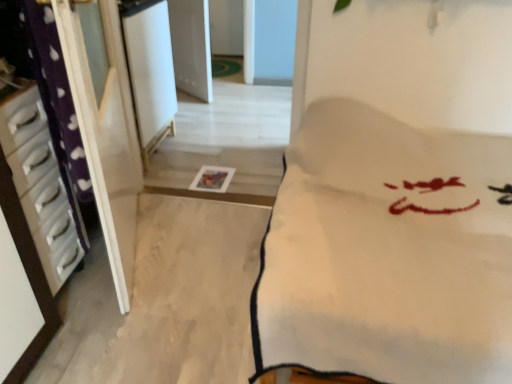
Question: Is white glossy drawer at left, which ranks as the 2th furniture in right-to-left order, oriented towards white glossy screen door at upper center?

Choices:
 (A) yes
 (B) no

Answer: (B)

Question: Is white glossy drawer at left, which ranks as the 2th furniture in right-to-left order, beside white glossy screen door at upper center?

Choices:
 (A) no
 (B) yes

Answer: (A)

Question: Is white glossy drawer at left, which ranks as the 2th furniture in right-to-left order, positioned in front of white glossy screen door at upper center?

Choices:
 (A) no
 (B) yes

Answer: (B)

Question: Considering the relative sizes of white glossy drawer at left, which ranks as the 2th furniture in right-to-left order, and white glossy screen door at upper center in the image provided, is white glossy drawer at left, which ranks as the 2th furniture in right-to-left order, wider than white glossy screen door at upper center?

Choices:
 (A) no
 (B) yes

Answer: (A)

Question: From the image's perspective, is white glossy drawer at left, which ranks as the 2th furniture in right-to-left order, over white glossy screen door at upper center?

Choices:
 (A) no
 (B) yes

Answer: (A)

Question: From a real-world perspective, is white glossy screen door at upper center above or below white soft blanket at center, which appears as the 2th furniture when viewed from the left?

Choices:
 (A) above
 (B) below

Answer: (A)

Question: Is point (144, 109) positioned closer to the camera than point (307, 294)?

Choices:
 (A) closer
 (B) farther

Answer: (B)

Question: From the image's perspective, is white glossy screen door at upper center positioned above or below white soft blanket at center, which is the first furniture in right-to-left order?

Choices:
 (A) below
 (B) above

Answer: (B)

Question: Is white glossy screen door at upper center situated inside white soft blanket at center, which appears as the 2th furniture when viewed from the left, or outside?

Choices:
 (A) inside
 (B) outside

Answer: (B)

Question: From a real-world perspective, relative to white soft blanket at center, which appears as the 2th furniture when viewed from the left, is white glossy drawer at left, which ranks as the 2th furniture in right-to-left order, vertically above or below?

Choices:
 (A) above
 (B) below

Answer: (B)

Question: Relative to white soft blanket at center, which appears as the 2th furniture when viewed from the left, is white glossy drawer at left, marked as the first furniture in a left-to-right arrangement, in front or behind?

Choices:
 (A) front
 (B) behind

Answer: (B)

Question: Is white glossy drawer at left, which ranks as the 2th furniture in right-to-left order, bigger or smaller than white soft blanket at center, which is the first furniture in right-to-left order?

Choices:
 (A) big
 (B) small

Answer: (B)

Question: Is white glossy drawer at left, which ranks as the 2th furniture in right-to-left order, situated inside white soft blanket at center, which appears as the 2th furniture when viewed from the left, or outside?

Choices:
 (A) outside
 (B) inside

Answer: (A)

Question: From the image's perspective, is white glossy drawer at left, which ranks as the 2th furniture in right-to-left order, above or below white glossy screen door at upper center?

Choices:
 (A) above
 (B) below

Answer: (B)

Question: From a real-world perspective, is white glossy drawer at left, which ranks as the 2th furniture in right-to-left order, positioned above or below white glossy screen door at upper center?

Choices:
 (A) above
 (B) below

Answer: (B)